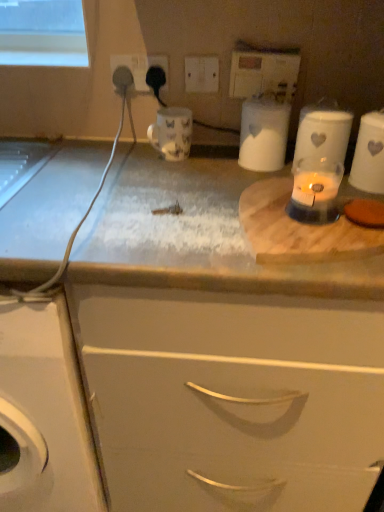
Where is `vacant space behind translucent glass candle at center`? vacant space behind translucent glass candle at center is located at coordinates (254, 177).